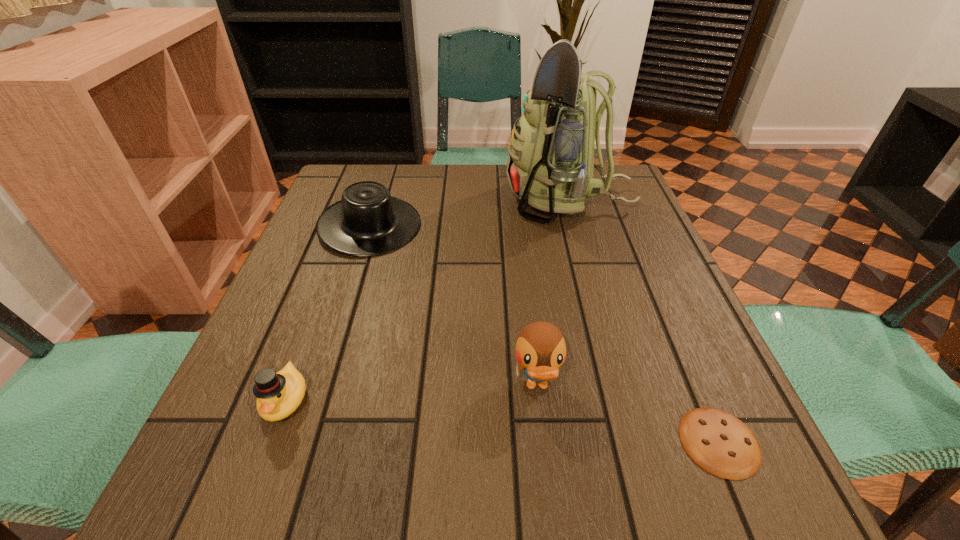
I want to click on backpack, so click(550, 162).

Find the location of a particular element. This screenshot has width=960, height=540. the fourth shortest object is located at coordinates (540, 349).

Where is `the right duck`? Image resolution: width=960 pixels, height=540 pixels. the right duck is located at coordinates point(540,349).

Find the location of a particular element. Image resolution: width=960 pixels, height=540 pixels. dress hat is located at coordinates (367, 221).

In order to click on the left duck in this screenshot , I will do (279, 394).

Image resolution: width=960 pixels, height=540 pixels. I want to click on cookie, so click(x=721, y=444).

The height and width of the screenshot is (540, 960). Identify the location of free space located 0.200m on the front-facing side of the backpack. (429, 200).

Where is `free space located 0.340m on the front-facing side of the backpack`? Image resolution: width=960 pixels, height=540 pixels. free space located 0.340m on the front-facing side of the backpack is located at coordinates (376, 200).

Find the location of a particular element. vacant space located on the front-facing side of the backpack is located at coordinates (433, 200).

Where is `vacant region located on the front-facing side of the right duck`? The image size is (960, 540). vacant region located on the front-facing side of the right duck is located at coordinates (551, 511).